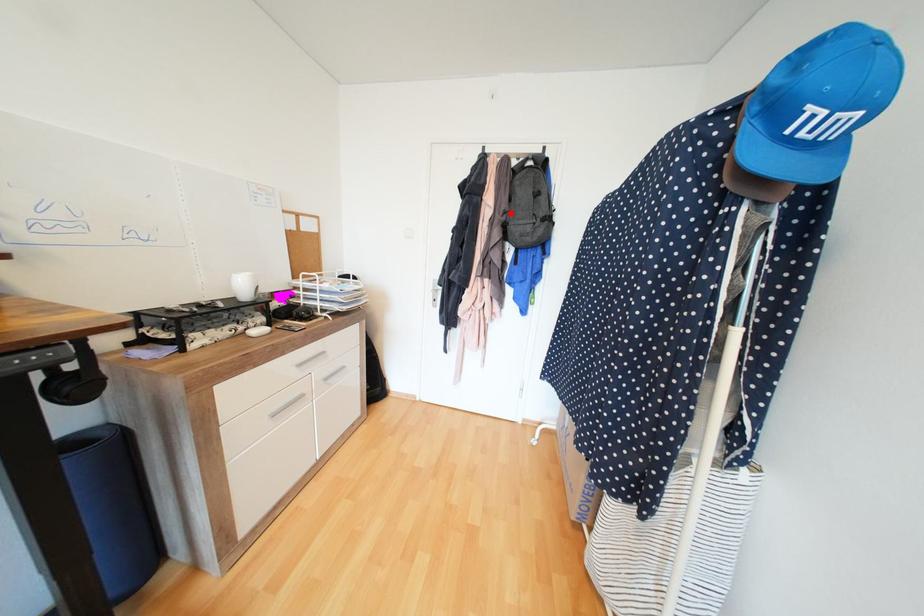
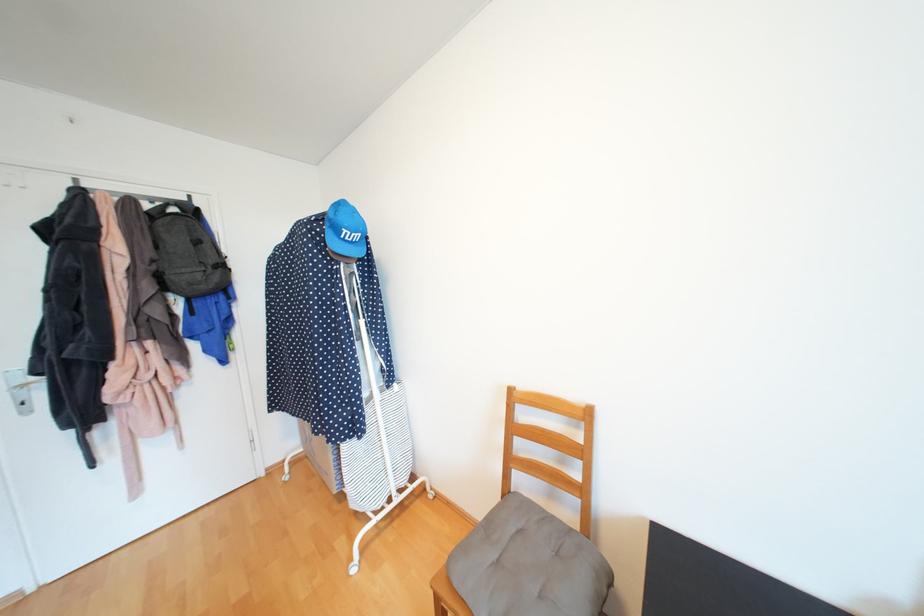
Locate, in the second image, the point that corresponds to the highlighted location in the first image.

(160, 262)